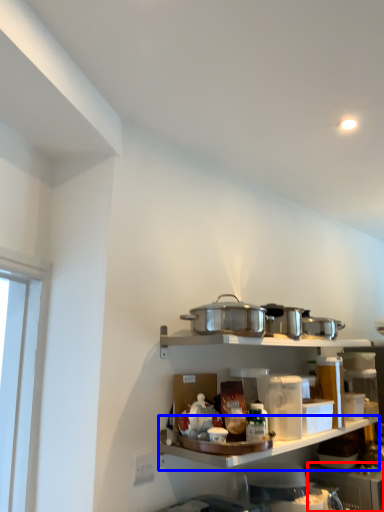
Question: Which object appears farthest to the camera in this image, appliance (highlighted by a red box) or shelf (highlighted by a blue box)?

Choices:
 (A) appliance
 (B) shelf

Answer: (A)